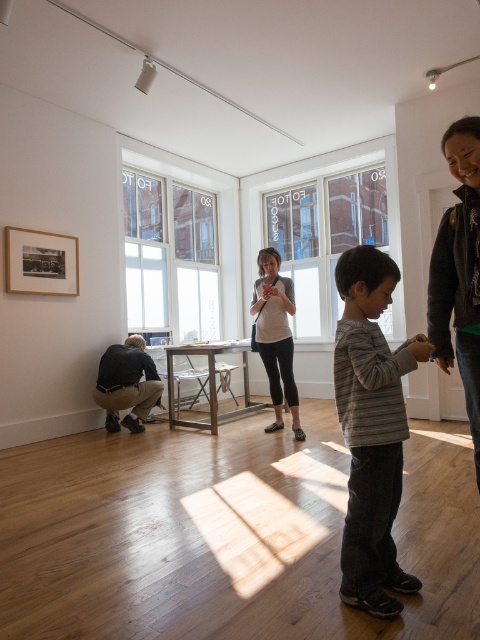
Does dark gray fabric pants at lower left lie in front of wooden picture frame at upper left?

No.

Which is behind, point (136, 352) or point (34, 289)?

Positioned behind is point (136, 352).

Which is behind, point (109, 394) or point (9, 260)?

Point (109, 394)

Where is `dark gray fabric pants at lower left`? dark gray fabric pants at lower left is located at coordinates (127, 385).

Which is below, striped cotton shirt at center or dark gray fabric pants at lower left?

dark gray fabric pants at lower left is below.

Can you confirm if striped cotton shirt at center is thinner than dark gray fabric pants at lower left?

Yes, striped cotton shirt at center is thinner than dark gray fabric pants at lower left.

Who is more distant from viewer, (348, 330) or (130, 372)?

Positioned behind is point (130, 372).

Where is `striped cotton shirt at center`? The height and width of the screenshot is (640, 480). striped cotton shirt at center is located at coordinates (372, 429).

In the scene shown: Does striped cotton shirt at center appear on the left side of dark gray sweater at right?

Yes, striped cotton shirt at center is to the left of dark gray sweater at right.

Is striped cotton shirt at center bigger than dark gray sweater at right?

No.

Which is behind, point (380, 484) or point (456, 228)?

The point (456, 228) is more distant.

Locate an element on the screen. striped cotton shirt at center is located at coordinates (372, 429).